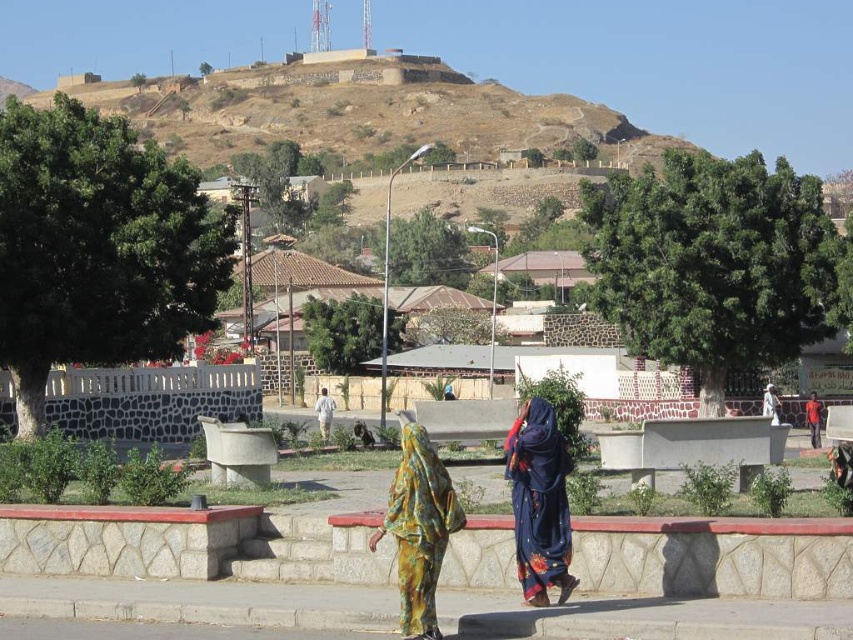
You are a photographer trying to capture both the blue floral fabric at center and the floral fabric dress at center in the same frame. Which object should you focus on first to ensure both are in the frame?

The blue floral fabric at center is shorter than the floral fabric dress at center, so you should focus on the floral fabric dress at center first to ensure both are in the frame.

You are a photographer trying to capture both the floral fabric dress at center and the white cotton shirt at center in the same frame. Which of the two clothing items should you focus on first if you want to ensure both are in focus, considering their sizes?

The floral fabric dress at center is smaller than the white cotton shirt at center, so you should focus on the white cotton shirt at center first to ensure both are in focus.

You are a photographer trying to capture both the blue floral fabric at center and the floral fabric dress at center in a single frame. Which object should you focus on first to ensure both are in the frame?

The blue floral fabric at center is smaller than the floral fabric dress at center, so you should focus on the floral fabric dress at center first to ensure both fit within the frame.